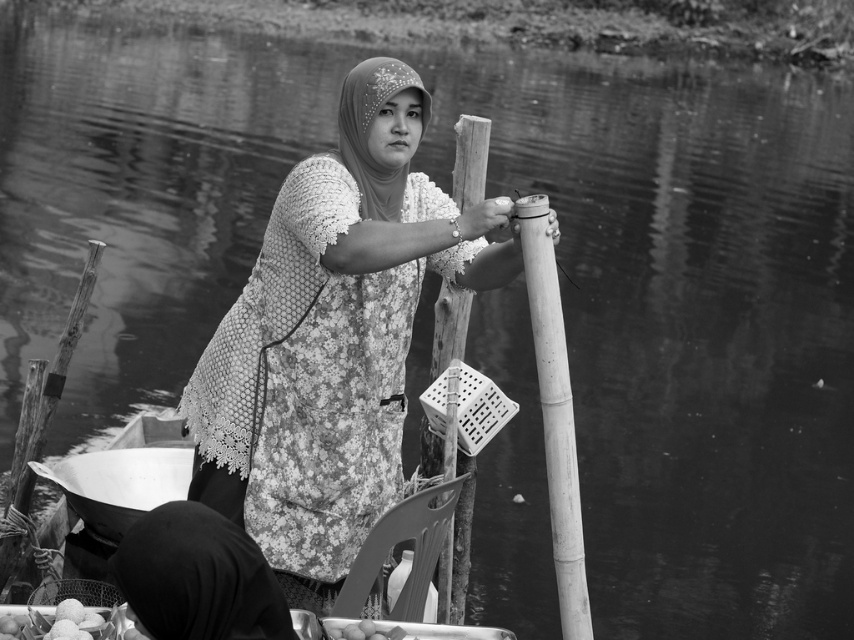
Is point (357, 186) farther from camera compared to point (443, 333)?

No, it is in front of (443, 333).

Image resolution: width=854 pixels, height=640 pixels. What do you see at coordinates (332, 337) in the screenshot?
I see `lace fabric dress at center` at bounding box center [332, 337].

The height and width of the screenshot is (640, 854). Identify the location of lace fabric dress at center. (332, 337).

Is black lace dress at lower center thinner than smooth white eggs at lower center?

In fact, black lace dress at lower center might be wider than smooth white eggs at lower center.

Between black lace dress at lower center and smooth white eggs at lower center, which one appears on the left side from the viewer's perspective?

Positioned to the left is black lace dress at lower center.

Identify the location of black lace dress at lower center. Image resolution: width=854 pixels, height=640 pixels. (196, 579).

Locate an element on the screen. The height and width of the screenshot is (640, 854). black lace dress at lower center is located at coordinates (196, 579).

Can you confirm if black lace dress at lower center is taller than bamboo pole at center?

In fact, black lace dress at lower center may be shorter than bamboo pole at center.

Is point (266, 611) more distant than point (541, 348)?

No, (266, 611) is closer to viewer.

Identify the location of black lace dress at lower center. (196, 579).